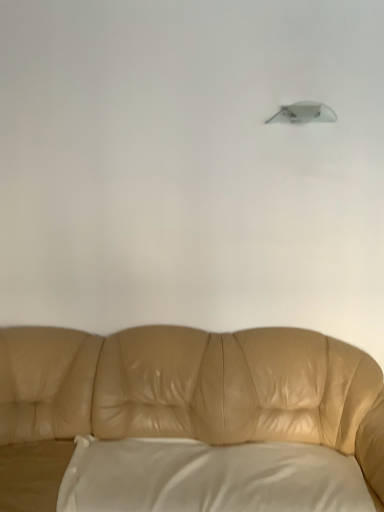
Question: Does point (94, 465) appear closer or farther from the camera than point (311, 113)?

Choices:
 (A) farther
 (B) closer

Answer: (B)

Question: Is white satin pillow at lower center taller or shorter than satin gray lampshade at upper center?

Choices:
 (A) tall
 (B) short

Answer: (A)

Question: Which is nearer to the white satin pillow at lower center?

Choices:
 (A) satin gray lampshade at upper center
 (B) tan leather couch at center

Answer: (B)

Question: Which object is positioned farthest from the tan leather couch at center?

Choices:
 (A) satin gray lampshade at upper center
 (B) white satin pillow at lower center

Answer: (A)